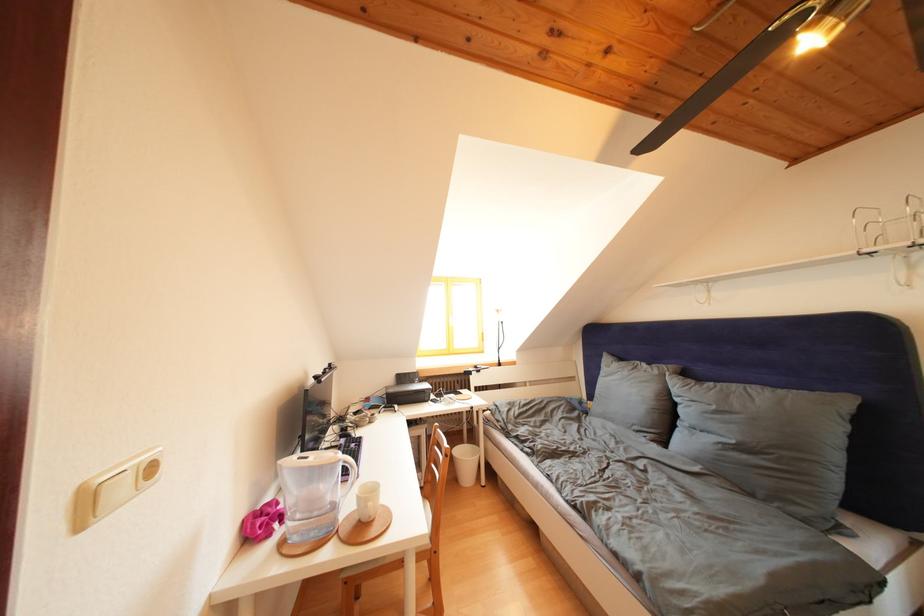
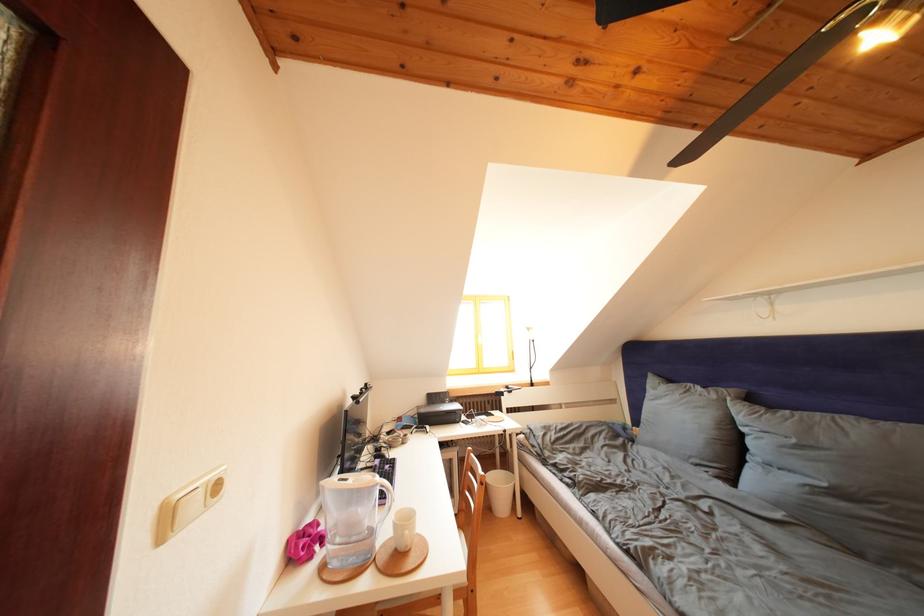
The point at (x=148, y=469) is marked in the first image. Where is the corresponding point in the second image?

(216, 487)